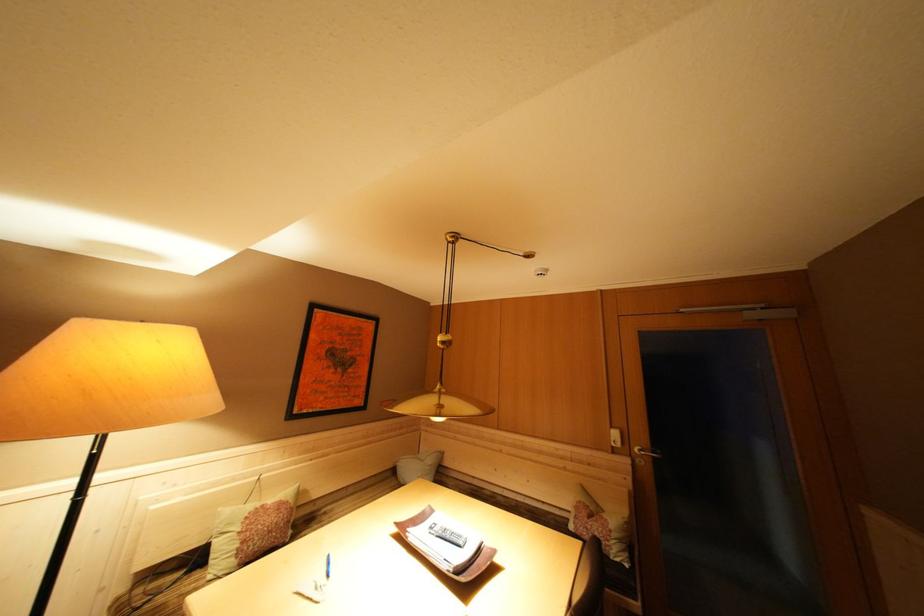
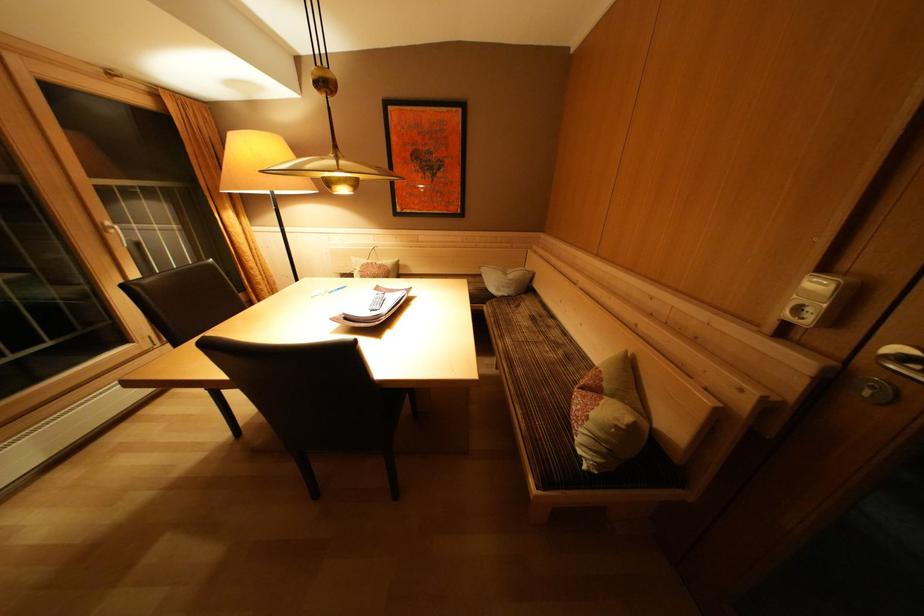
The point at (626, 450) is marked in the first image. Where is the corresponding point in the second image?

(815, 326)